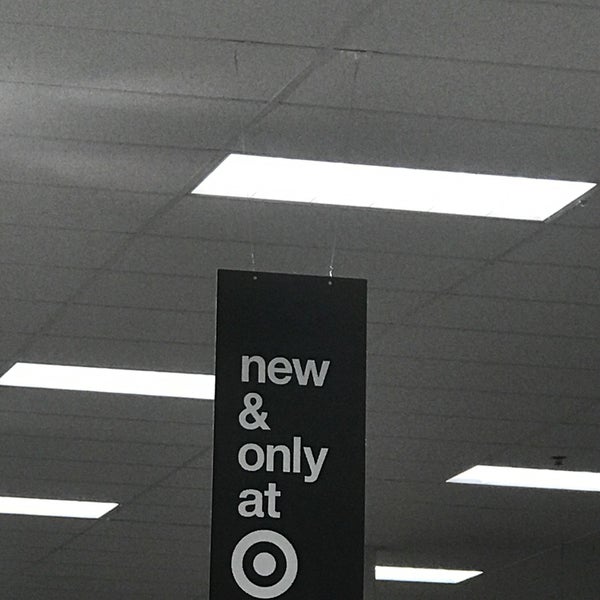
I want to click on ceiling peg, so click(99, 428).